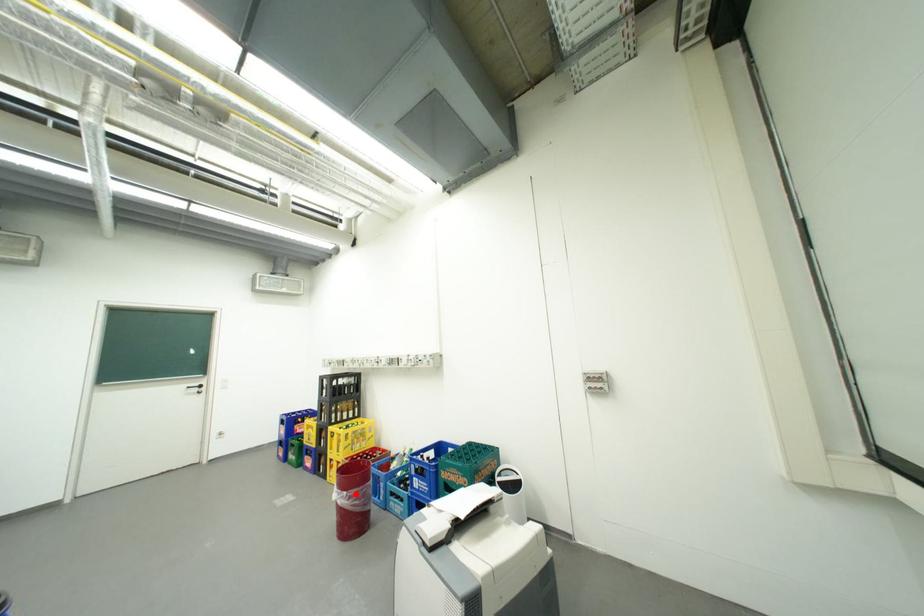
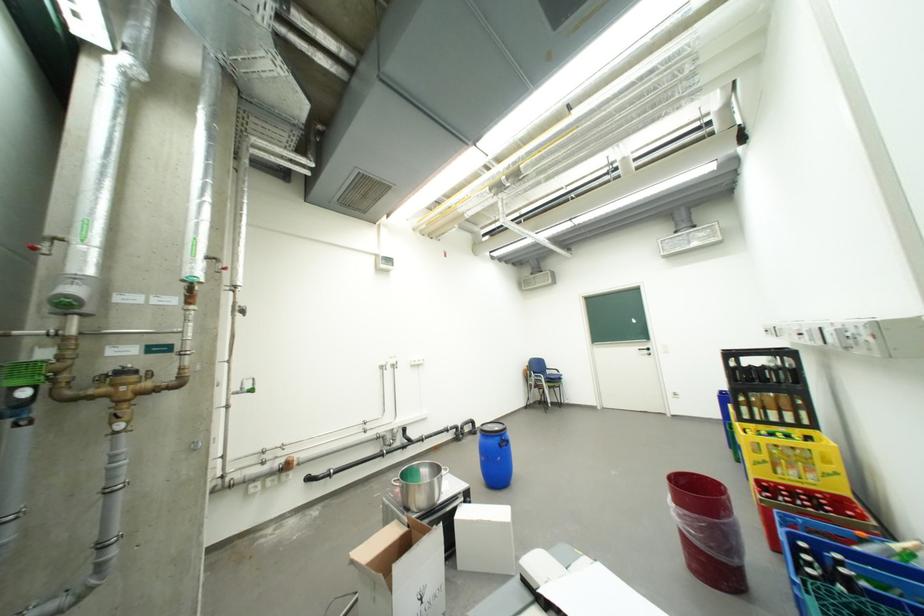
Question: I am providing you with two images of the same scene from different viewpoints. In image1, a red point is highlighted. Considering the same 3D point in image2, which of the following is correct?

Choices:
 (A) It is closer
 (B) It is farther

Answer: (A)